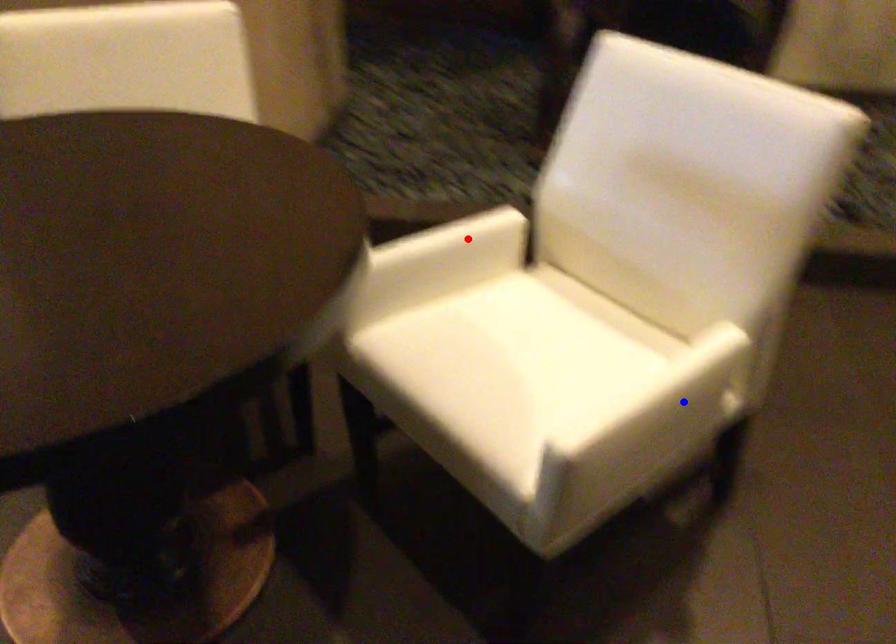
Question: Two points are marked on the image. Which point is closer to the camera?

Choices:
 (A) Blue point is closer.
 (B) Red point is closer.

Answer: (A)